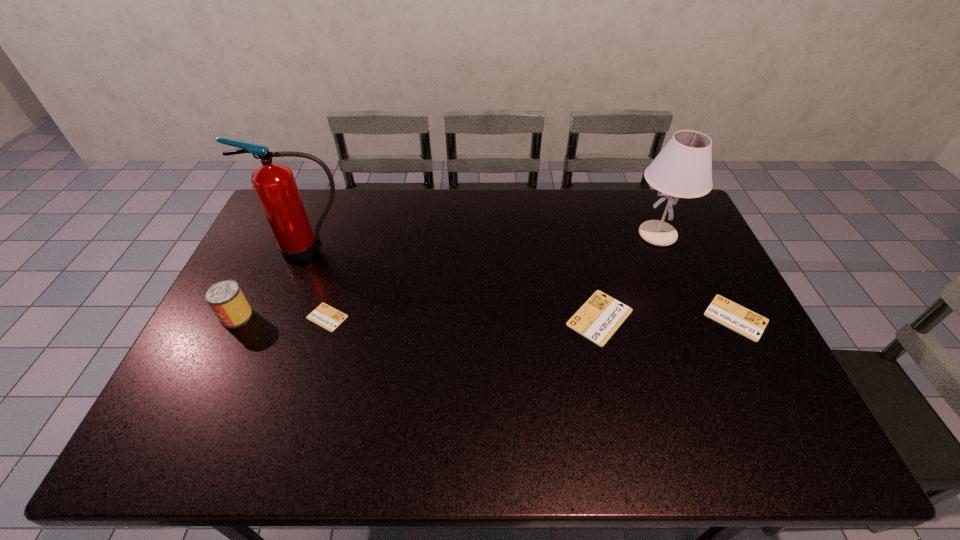
Locate an element on the screen. vacant space situated on the left of the second shortest object is located at coordinates (605, 318).

Locate an element on the screen. This screenshot has width=960, height=540. vacant area located 0.240m on the front of the lampshade is located at coordinates (690, 312).

I want to click on free space located on the left of the fire extinguisher, so click(x=252, y=250).

Where is `free location located 0.250m on the front of the can`? free location located 0.250m on the front of the can is located at coordinates (190, 411).

Identify the location of object that is at the far edge. This screenshot has width=960, height=540. (683, 169).

Identify the location of fire extinguisher located in the left edge section of the desktop. (274, 183).

Image resolution: width=960 pixels, height=540 pixels. I want to click on can that is at the left edge, so click(225, 298).

Locate an element on the screen. The width and height of the screenshot is (960, 540). identity card situated at the right edge is located at coordinates (728, 313).

Locate an element on the screen. This screenshot has width=960, height=540. lampshade located at the right edge is located at coordinates (683, 169).

Locate an element on the screen. The width and height of the screenshot is (960, 540). object present at the far right corner is located at coordinates (683, 169).